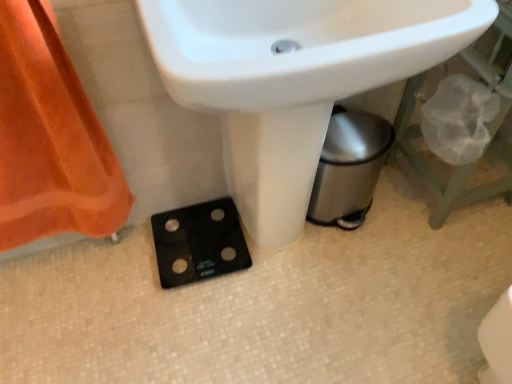
What are the coordinates of `vacant area on top of black glass scale at lower center (from a real-world perspective)` in the screenshot? It's located at (205, 243).